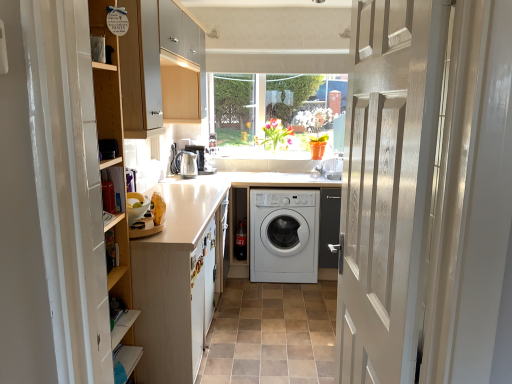
What do you see at coordinates (185, 164) in the screenshot? The height and width of the screenshot is (384, 512). I see `satin silver kettle at center` at bounding box center [185, 164].

Identify the location of white wood door at center. (388, 185).

Where is `white matte cabinet at left`? This screenshot has height=384, width=512. white matte cabinet at left is located at coordinates (177, 282).

Locate an element on the screen. This screenshot has width=512, height=384. satin silver kettle at center is located at coordinates (185, 164).

Consider the image. From the image's perspective, would you say white matte washing machine at center is positioned over satin silver kettle at center?

No.

Between point (266, 269) and point (195, 174), which one is positioned in front?

The point (266, 269) is in front.

From a real-world perspective, between white matte washing machine at center and satin silver kettle at center, who is vertically higher?

satin silver kettle at center is physically above.

What's the angular difference between satin silver kettle at center and white matte cabinet at left's facing directions?

The angle between the facing direction of satin silver kettle at center and the facing direction of white matte cabinet at left is 1.25 degrees.

Identify the location of cabinetry below the satin silver kettle at center (from a real-world perspective). The height and width of the screenshot is (384, 512). (177, 282).

In terms of size, does satin silver kettle at center appear bigger or smaller than white matte cabinet at left?

Clearly, satin silver kettle at center is smaller in size than white matte cabinet at left.

Would you say satin silver kettle at center is inside or outside white matte cabinet at left?

satin silver kettle at center is not inside white matte cabinet at left, it's outside.

Is white matte cabinet at left inside the boundaries of white wood door at center, or outside?

white matte cabinet at left is not enclosed by white wood door at center.

Identify the location of door located in front of the white matte cabinet at left. This screenshot has height=384, width=512. (388, 185).

Considering the relative sizes of white matte cabinet at left and white wood door at center in the image provided, is white matte cabinet at left smaller than white wood door at center?

No.

Which of these two, white matte washer at center or white wood door at center, is thinner?

With smaller width is white wood door at center.

Is white matte washer at center completely or partially outside of white wood door at center?

Yes, white matte washer at center is not within white wood door at center.

Looking at this image, between white matte washer at center and white wood door at center, which one has larger size?

With larger size is white wood door at center.

How far apart are white matte washer at center and white wood door at center?

The distance of white matte washer at center from white wood door at center is 1.46 meters.

From the image's perspective, would you say white matte washing machine at center is shown under white matte washer at center?

No, from the image's perspective, white matte washing machine at center is not below white matte washer at center.

Is white matte washing machine at center next to white matte washer at center?

white matte washing machine at center and white matte washer at center are not in contact.

Considering the sizes of objects white matte washing machine at center and white matte washer at center in the image provided, who is smaller, white matte washing machine at center or white matte washer at center?

white matte washer at center is smaller.

Does white matte washing machine at center contain white matte washer at center?

No, white matte washing machine at center does not contain white matte washer at center.

From the image's perspective, is white matte cabinet at left located above satin silver kettle at center?

Incorrect, from the image's perspective, white matte cabinet at left is lower than satin silver kettle at center.

Image resolution: width=512 pixels, height=384 pixels. What are the coordinates of `water heater on the left of white matte cabinet at left` in the screenshot? It's located at (185, 164).

Which object is positioned more to the left, white matte cabinet at left or satin silver kettle at center?

satin silver kettle at center.

Based on their sizes in the image, would you say white matte cabinet at left is bigger or smaller than satin silver kettle at center?

Considering their sizes, white matte cabinet at left takes up more space than satin silver kettle at center.

From a real-world perspective, is white wood door at center positioned over satin silver kettle at center based on gravity?

Yes, from a real-world perspective, white wood door at center is above satin silver kettle at center.

Based on their positions, is white wood door at center located to the left or right of satin silver kettle at center?

white wood door at center is to the right of satin silver kettle at center.

Looking at this image, who is bigger, white wood door at center or satin silver kettle at center?

Bigger between the two is white wood door at center.

Locate an element on the screen. Image resolution: width=512 pixels, height=384 pixels. water heater behind the white matte washing machine at center is located at coordinates (185, 164).

I want to click on cabinetry below the satin silver kettle at center (from the image's perspective), so click(177, 282).

From the image, which object appears to be farther from white matte washing machine at center, white matte washer at center or satin silver kettle at center?

Based on the image, satin silver kettle at center appears to be further to white matte washing machine at center.

Consider the image. When comparing their distances from white matte washer at center, does white matte washing machine at center or white wood door at center seem further?

The object further to white matte washer at center is white wood door at center.

Consider the image. Which object lies nearer to the anchor point white wood door at center, white matte washer at center or white matte washing machine at center?

Based on the image, white matte washer at center appears to be nearer to white wood door at center.

When comparing their distances from satin silver kettle at center, does white wood door at center or white matte cabinet at left seem further?

white wood door at center lies further to satin silver kettle at center than the other object.

Considering their positions, is white wood door at center positioned closer to white matte cabinet at left than satin silver kettle at center?

white wood door at center is positioned closer to the anchor white matte cabinet at left.

Estimate the real-world distances between objects in this image. Which object is further from satin silver kettle at center, white matte washer at center or white matte cabinet at left?

white matte washer at center is positioned further to the anchor satin silver kettle at center.

Considering their positions, is white matte washer at center positioned further to white wood door at center than satin silver kettle at center?

Among the two, satin silver kettle at center is located further to white wood door at center.

Estimate the real-world distances between objects in this image. Which object is closer to white matte cabinet at left, white wood door at center or white matte washing machine at center?

white matte washing machine at center is closer to white matte cabinet at left.

The width and height of the screenshot is (512, 384). Identify the location of cabinetry between white wood door at center and white matte washer at center along the z-axis. (177, 282).

Image resolution: width=512 pixels, height=384 pixels. Identify the location of plain between white matte cabinet at left and white matte washing machine at center in the front-back direction. (272, 334).

Find the location of `plain between white matte cabinet at left and satin silver kettle at center in the front-back direction`. plain between white matte cabinet at left and satin silver kettle at center in the front-back direction is located at coordinates (272, 334).

I want to click on washing machine between white matte washer at center and satin silver kettle at center in the front-back direction, so click(284, 235).